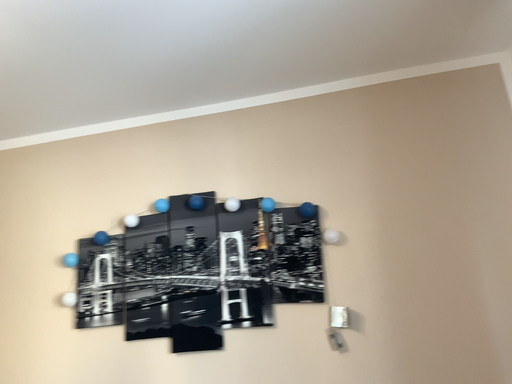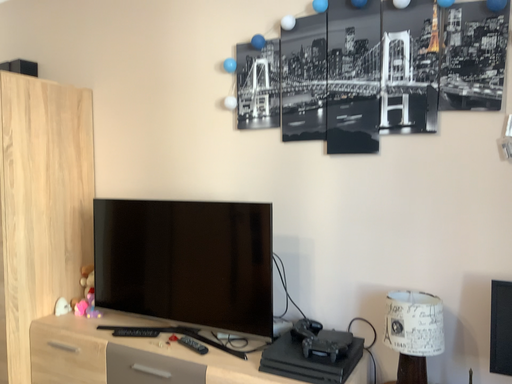
Question: How did the camera likely rotate when shooting the video?

Choices:
 (A) rotated downward
 (B) rotated upward

Answer: (A)